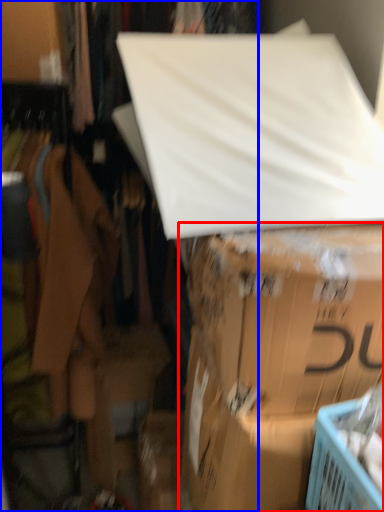
Question: Which of the following is the closest to the observer, box (highlighted by a red box) or closet (highlighted by a blue box)?

Choices:
 (A) box
 (B) closet

Answer: (A)